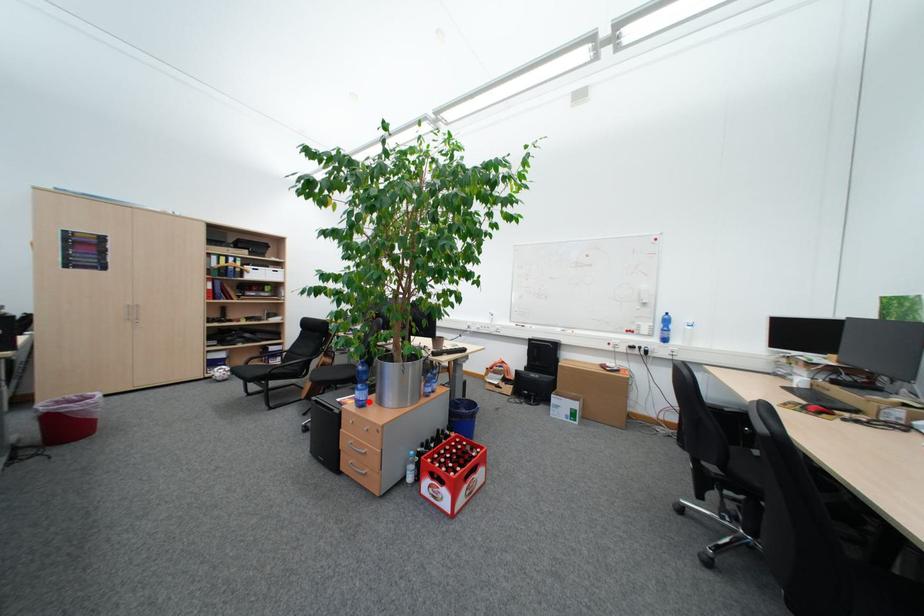
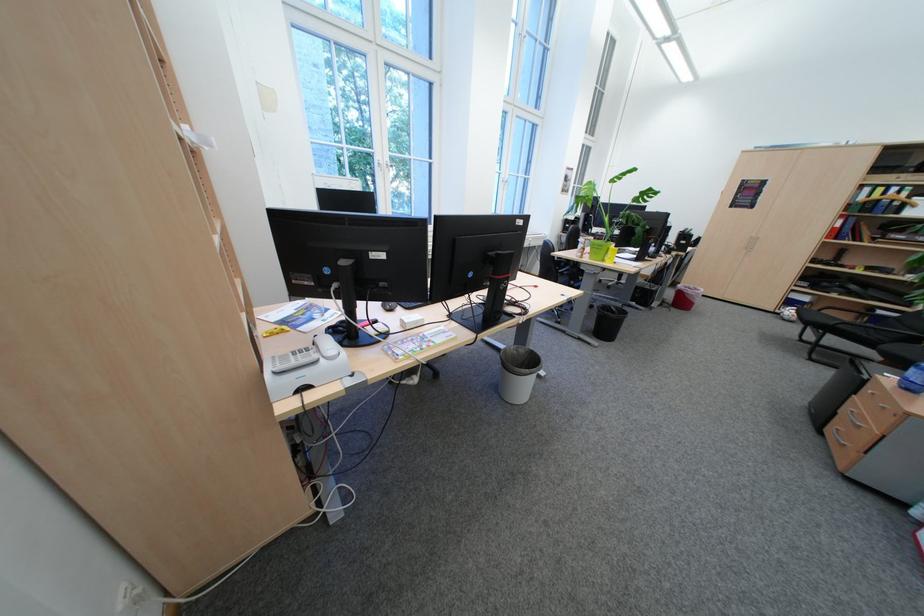
Find the pixel in the second image that matches the highlighted location in the first image.

(917, 381)